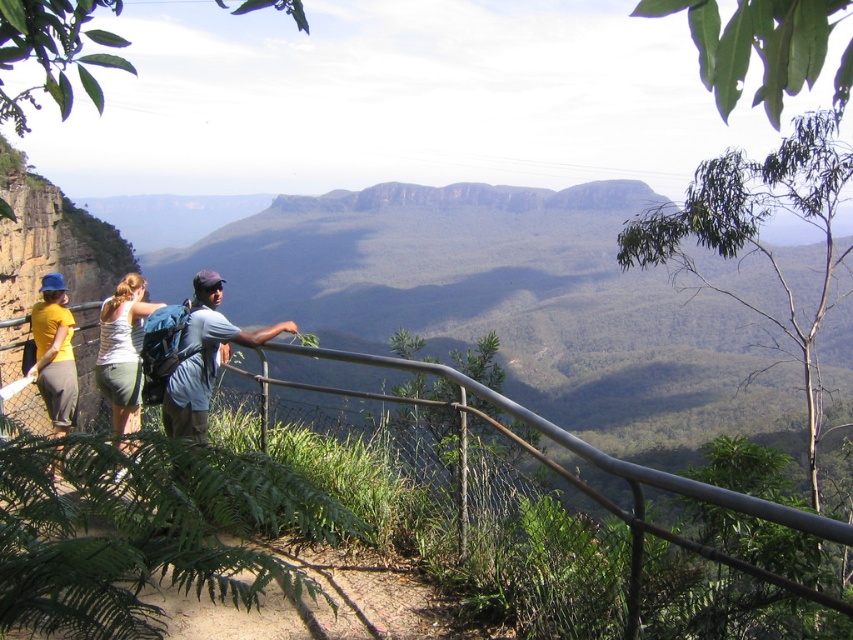
You are standing at the overlook and want to locate the exact point marked as point (x=560, y=468). According to the scene description, where would this point be located?

The point (x=560, y=468) is on the metallic gray rail at upper center.

You are standing at the scenic overlook and want to take a photo of two specific points in the landscape. The first point is located at coordinates point (239, 332) and the second point is at point (137, 372). Which point will appear larger in your photo?

Point (239, 332) will appear larger in the photo because it is closer to the viewer than point (137, 372).